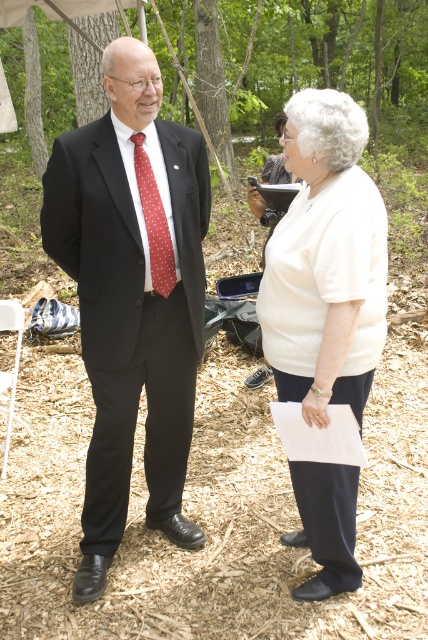
Is point (318, 582) farther from camera compared to point (131, 416)?

No, it is not.

Between point (187, 396) and point (130, 40), which one is positioned behind?

The point (187, 396) is behind.

What are the coordinates of `matte black suit at center` in the screenshot? It's located at (127, 300).

Is point (270, 276) behind point (166, 232)?

No, (270, 276) is in front of (166, 232).

Between white cotton shirt at center and red dotted fabric tie at center, which one appears on the right side from the viewer's perspective?

white cotton shirt at center

Which is behind, point (296, 328) or point (175, 276)?

Positioned behind is point (175, 276).

The image size is (428, 640). I want to click on white cotton shirt at center, so click(x=326, y=262).

Is matte black suit at center positioned before white cotton shirt at center?

No, it is behind white cotton shirt at center.

Is matte black suit at center smaller than white cotton shirt at center?

No.

Image resolution: width=428 pixels, height=640 pixels. Identify the location of matte black suit at center. (127, 300).

Where is `matte black suit at center`? matte black suit at center is located at coordinates tap(127, 300).